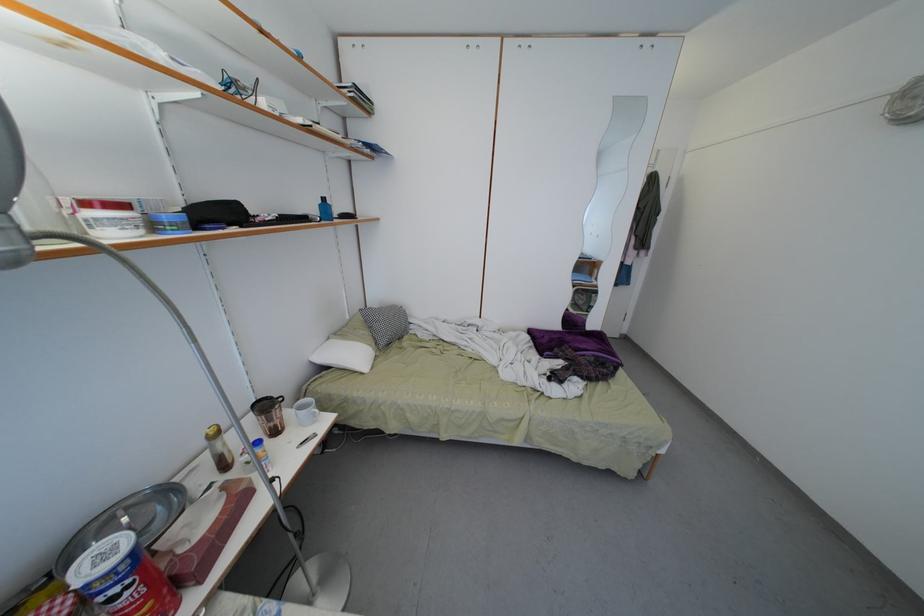
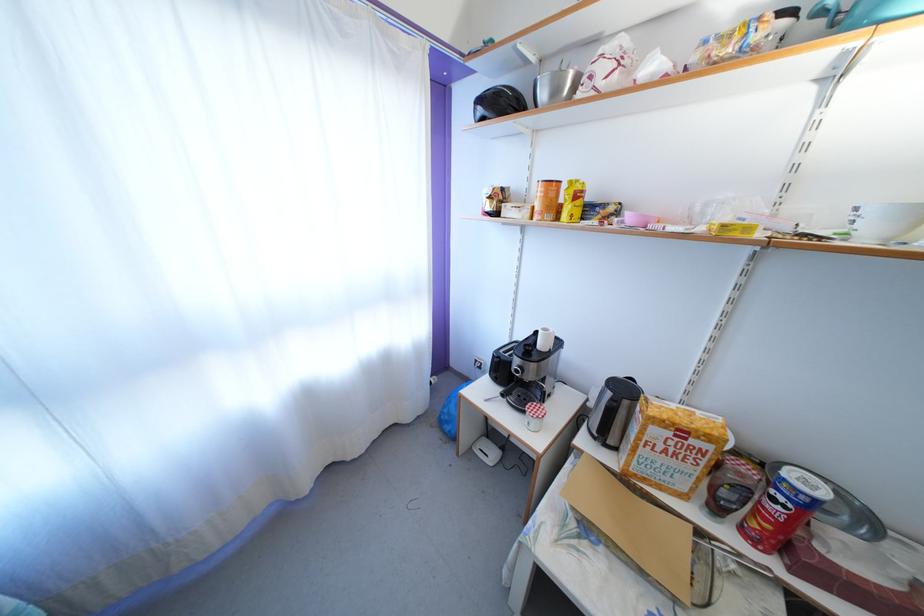
Find the pixel in the second image that matches (139,559) in the first image.

(821, 508)